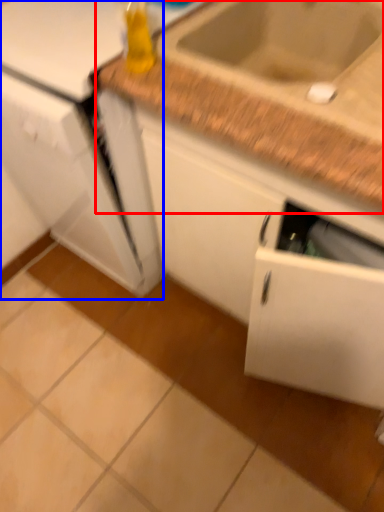
Question: Which object is further to the camera taking this photo, countertop (highlighted by a red box) or appliance (highlighted by a blue box)?

Choices:
 (A) countertop
 (B) appliance

Answer: (B)